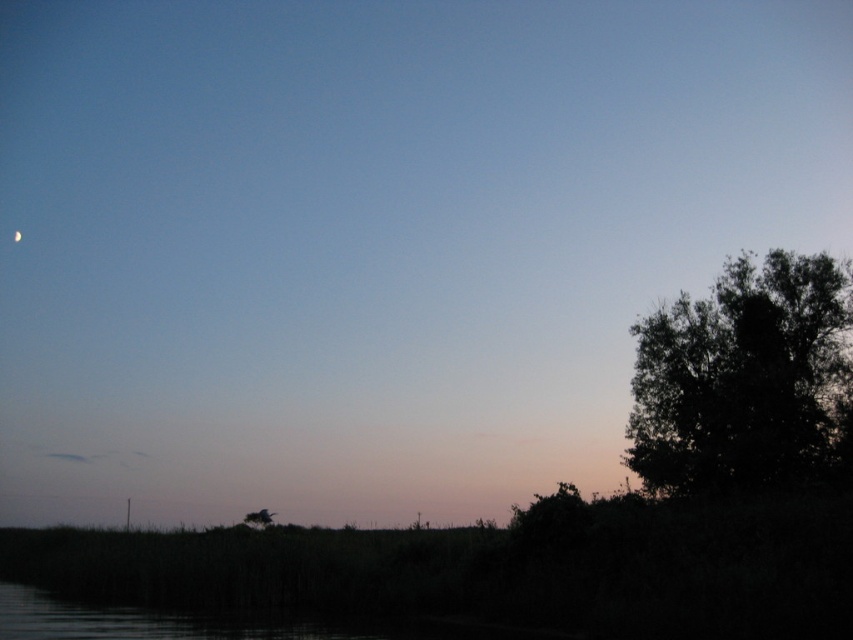
You are standing at the center of the image and looking towards the right side. There is a point marked at coordinates point (741, 376). What object is located at this point?

The point (741, 376) indicates a dark green leafy tree at right.

You are an astronomer observing the twilight scene. You notice the dark green leafy tree at right and the silver metallic moon at upper left. Which object has a greater width in the image?

The dark green leafy tree at right has a greater width than the silver metallic moon at upper left.